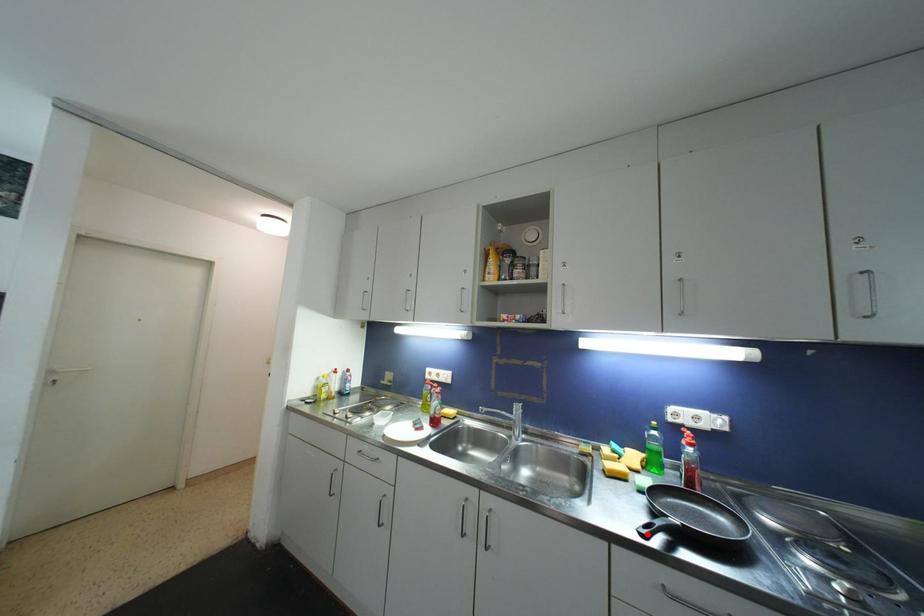
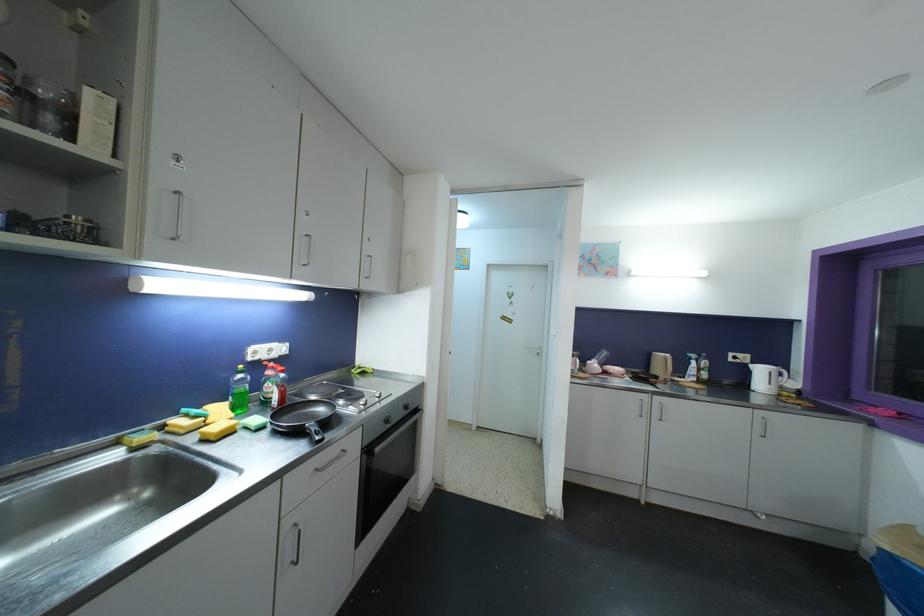
The point at the highlighted location is marked in the first image. Where is the corresponding point in the second image?

(321, 440)